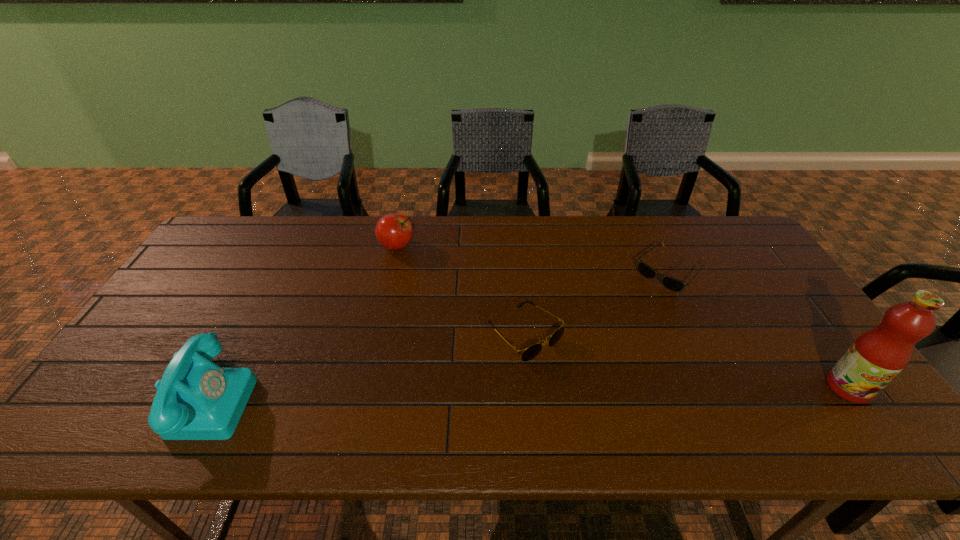
Find the location of a particular element. blank region between the shorter sunglasses and the left sunglasses is located at coordinates (597, 303).

Select which object appears as the third closest to the telephone. Please provide its 2D coordinates. Your answer should be formatted as a tuple, i.e. [(x, y)], where the tuple contains the x and y coordinates of a point satisfying the conditions above.

[(670, 283)]

Identify the location of the closest object relative to the tallest object. Image resolution: width=960 pixels, height=540 pixels. (670, 283).

Locate an element on the screen. Image resolution: width=960 pixels, height=540 pixels. vacant space that satisfies the following two spatial constraints: 1. on the front side of the third shortest object; 2. on the left side of the nearer sunglasses is located at coordinates (376, 334).

Where is `vacant space that satisfies the following two spatial constraints: 1. on the front side of the second object from left to right; 2. on the right side of the nearer sunglasses`? The width and height of the screenshot is (960, 540). vacant space that satisfies the following two spatial constraints: 1. on the front side of the second object from left to right; 2. on the right side of the nearer sunglasses is located at coordinates tap(376, 334).

The height and width of the screenshot is (540, 960). I want to click on vacant space that satisfies the following two spatial constraints: 1. on the back side of the shortest object; 2. on the left side of the taller sunglasses, so coord(519,272).